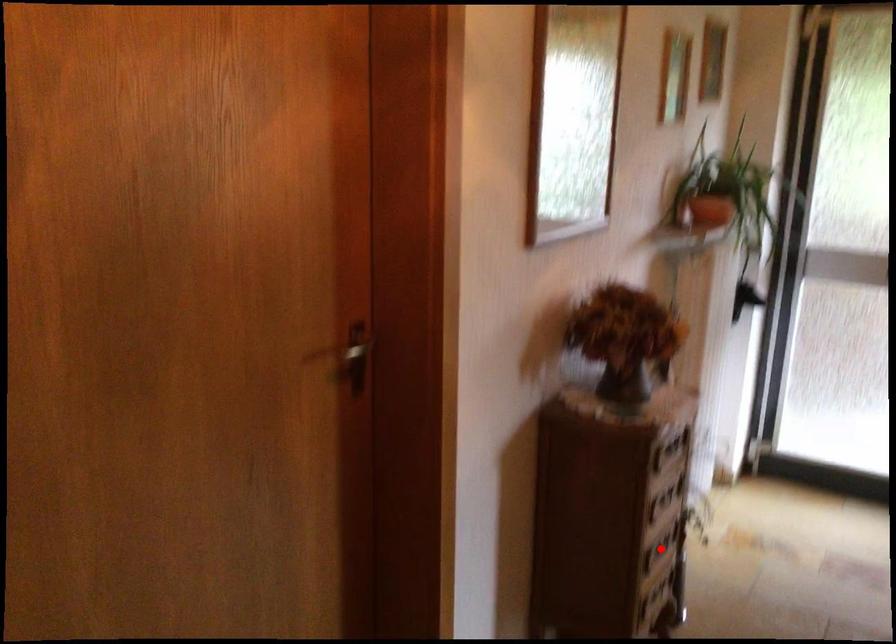
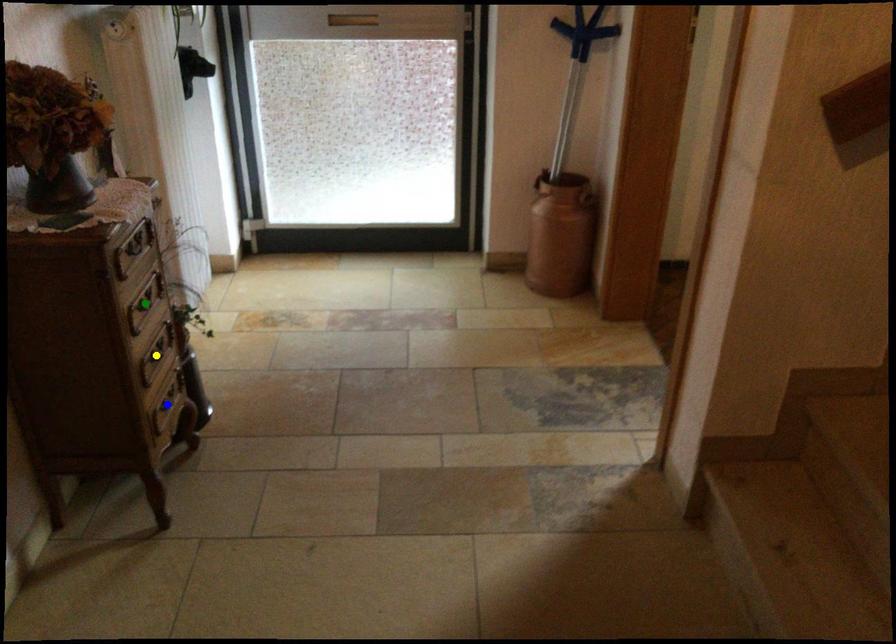
Question: I am providing you with two images of the same scene from different viewpoints. A red point is marked on the first image. You are given multiple points on the second image. Which point in image 2 represents the same 3d spot as the red point in image 1?

Choices:
 (A) blue point
 (B) green point
 (C) yellow point

Answer: (C)